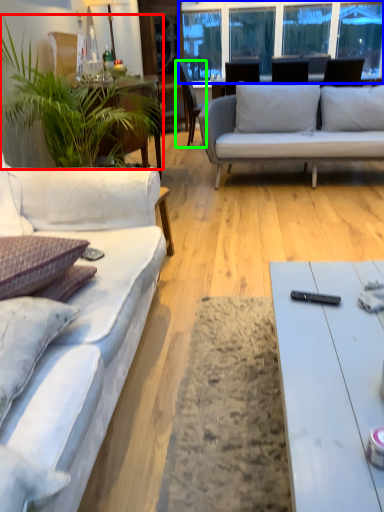
Question: Based on their relative distances, which object is nearer to houseplant (highlighted by a red box)? Choose from window screen (highlighted by a blue box) and chair (highlighted by a green box).

Choices:
 (A) window screen
 (B) chair

Answer: (B)